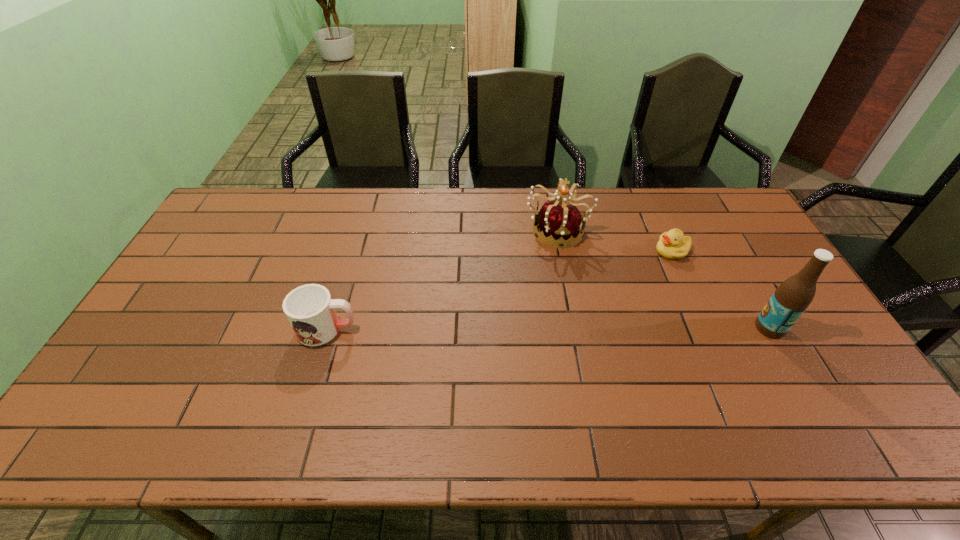
This screenshot has width=960, height=540. I want to click on free space at the left edge of the desktop, so click(x=234, y=242).

Find the location of a particular element. This screenshot has width=960, height=540. free location at the right edge is located at coordinates (731, 276).

Image resolution: width=960 pixels, height=540 pixels. I want to click on vacant region at the far right corner of the desktop, so click(x=704, y=197).

At what (x,y) coordinates should I click in order to perform the action: click on free region at the near right corner of the desktop. Please return your answer as a coordinate pair (x, y). The height and width of the screenshot is (540, 960). Looking at the image, I should click on (806, 396).

Where is `blank region between the duckling and the tiara`? This screenshot has width=960, height=540. blank region between the duckling and the tiara is located at coordinates (614, 240).

The width and height of the screenshot is (960, 540). Identify the location of vacant space in between the second object from left to right and the leftmost object. (442, 279).

I want to click on vacant space that is in between the leftmost object and the tallest object, so click(548, 328).

Where is `empty location between the leftmost object and the tallest object`? This screenshot has width=960, height=540. empty location between the leftmost object and the tallest object is located at coordinates (548, 328).

Locate an element on the screen. This screenshot has height=540, width=960. empty location between the mug and the second object from left to right is located at coordinates (442, 279).

Identify the location of blank region between the mug and the beer bottle. (548, 328).